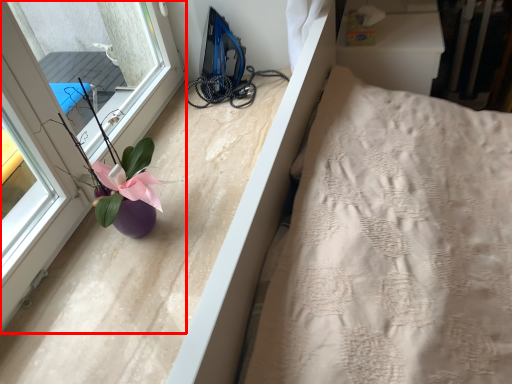
Question: From the image's perspective, where is window (annotated by the red box) located relative to floral arrangement?

Choices:
 (A) above
 (B) below

Answer: (A)